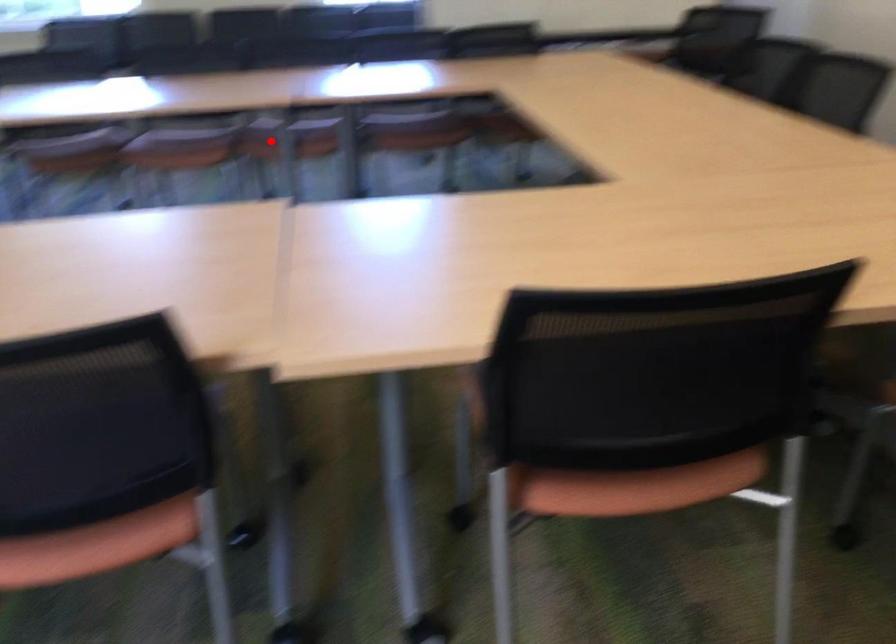
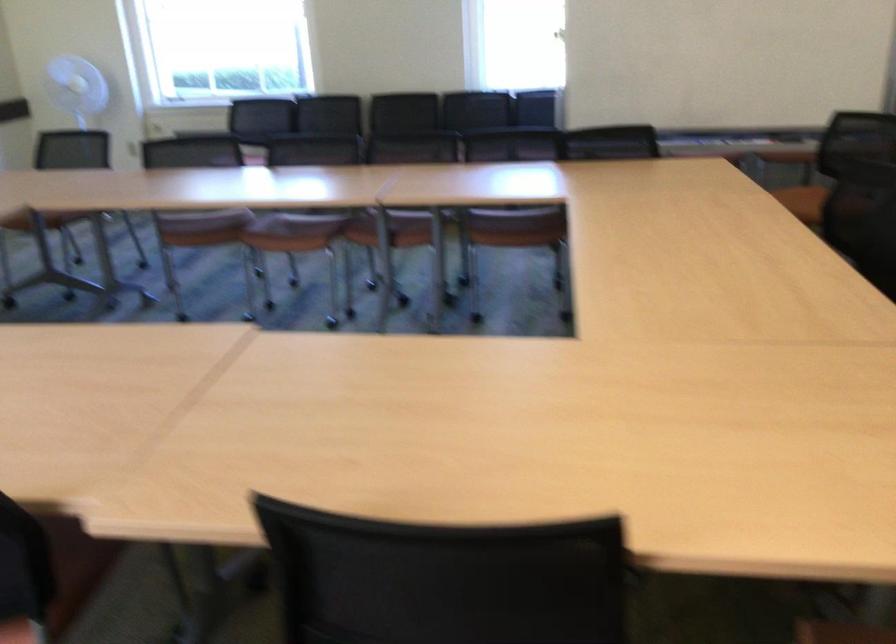
Where in the second image is the point corresponding to the highlighted location from the first image?

(391, 230)